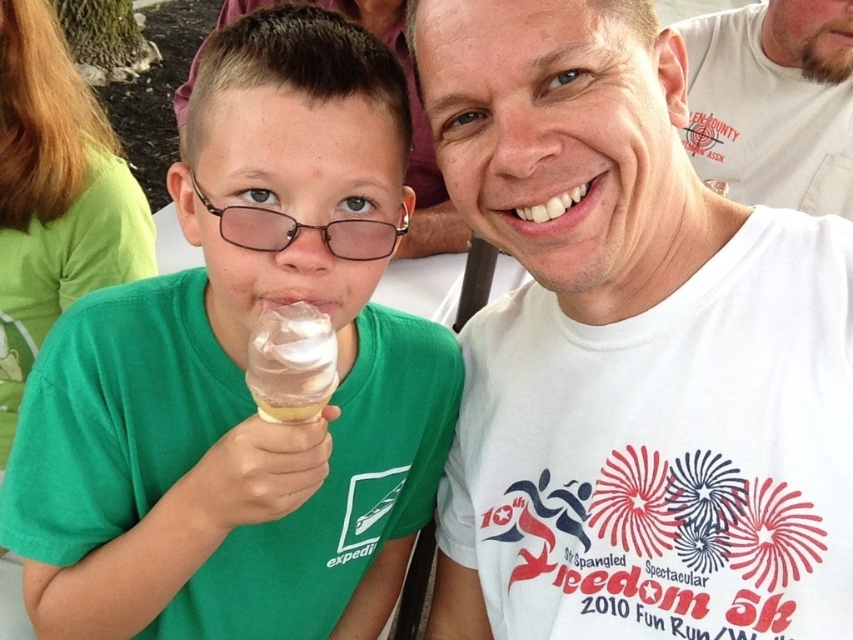
In the scene shown: Does white cotton t-shirt at center appear on the right side of white creamy ice cream at center?

Yes, white cotton t-shirt at center is to the right of white creamy ice cream at center.

Is white cotton t-shirt at center smaller than white creamy ice cream at center?

Incorrect, white cotton t-shirt at center is not smaller in size than white creamy ice cream at center.

Locate an element on the screen. This screenshot has width=853, height=640. white cotton t-shirt at center is located at coordinates (630, 353).

This screenshot has width=853, height=640. What are the coordinates of `white cotton t-shirt at center` in the screenshot? It's located at (630, 353).

Is white cotton t-shirt at center smaller than green matte shirt at center?

Correct, white cotton t-shirt at center occupies less space than green matte shirt at center.

Does point (602, 451) come closer to viewer compared to point (442, 337)?

Yes, it is in front of point (442, 337).

What do you see at coordinates (630, 353) in the screenshot? Image resolution: width=853 pixels, height=640 pixels. I see `white cotton t-shirt at center` at bounding box center [630, 353].

You are a GUI agent. You are given a task and a screenshot of the screen. Output one action in this format:
    pyautogui.click(x=<x>, y=<y>)
    Task: Click on the white cotton t-shirt at center
    Image resolution: width=853 pixels, height=640 pixels.
    Given the screenshot: What is the action you would take?
    point(630,353)

Is white cotton t-shirt at upper right in front of white creamy ice cream at center?

No.

Who is taller, white cotton t-shirt at upper right or white creamy ice cream at center?

white cotton t-shirt at upper right

Who is more forward, (709, 108) or (254, 332)?

Positioned in front is point (254, 332).

You are a GUI agent. You are given a task and a screenshot of the screen. Output one action in this format:
    pyautogui.click(x=<x>, y=<y>)
    Task: Click on the white cotton t-shirt at upper right
    The image size is (853, 640).
    Given the screenshot: What is the action you would take?
    pyautogui.click(x=773, y=102)